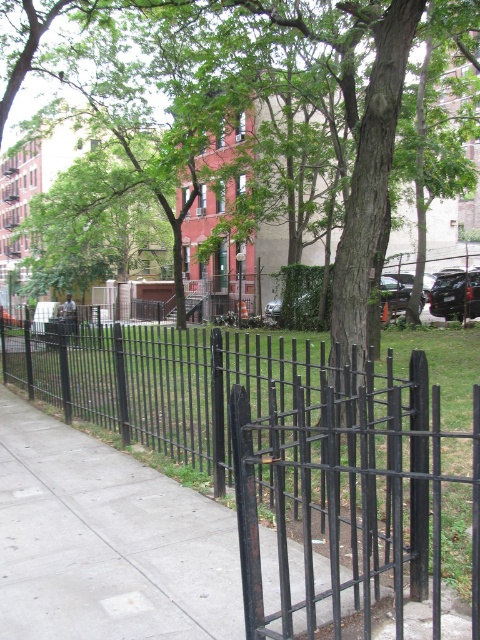
Question: In this image, where is black metal fence at center located relative to green leafy tree at center?

Choices:
 (A) left
 (B) right

Answer: (A)

Question: Does black metal fence at center have a greater width compared to green leafy tree at center?

Choices:
 (A) yes
 (B) no

Answer: (B)

Question: Considering the relative positions of black metal fence at center and green leafy tree at center in the image provided, where is black metal fence at center located with respect to green leafy tree at center?

Choices:
 (A) left
 (B) right

Answer: (A)

Question: Which of the following is the farthest from the observer?

Choices:
 (A) (324, 381)
 (B) (362, 24)

Answer: (B)